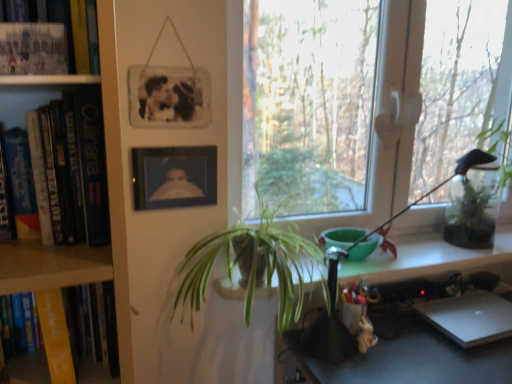
Question: Is transparent glass window at center positioned behind hardcover book at left, which ranks as the third book in top-to-bottom order?

Choices:
 (A) yes
 (B) no

Answer: (A)

Question: Considering the relative positions of transparent glass window at center and hardcover book at left, acting as the second book starting from the bottom, in the image provided, is transparent glass window at center to the left of hardcover book at left, acting as the second book starting from the bottom, from the viewer's perspective?

Choices:
 (A) yes
 (B) no

Answer: (B)

Question: Is transparent glass window at center to the right of hardcover book at left, which ranks as the third book in top-to-bottom order, from the viewer's perspective?

Choices:
 (A) no
 (B) yes

Answer: (B)

Question: Is hardcover book at left, acting as the second book starting from the bottom, at the back of transparent glass window at center?

Choices:
 (A) yes
 (B) no

Answer: (B)

Question: From a real-world perspective, is transparent glass window at center on hardcover book at left, which ranks as the third book in top-to-bottom order?

Choices:
 (A) yes
 (B) no

Answer: (A)

Question: Can you confirm if transparent glass window at center is taller than hardcover book at left, which ranks as the third book in top-to-bottom order?

Choices:
 (A) yes
 (B) no

Answer: (A)

Question: Can you confirm if black matte picture frame at upper center, which is the 1th picture frame in top-to-bottom order, is smaller than green leafy plant at right, which is the 1th houseplant from back to front?

Choices:
 (A) yes
 (B) no

Answer: (A)

Question: From the image's perspective, is black matte picture frame at upper center, marked as the 2th picture frame in a bottom-to-top arrangement, over green leafy plant at right, the second houseplant from the left?

Choices:
 (A) no
 (B) yes

Answer: (B)

Question: Is black matte picture frame at upper center, marked as the 2th picture frame in a bottom-to-top arrangement, turned away from green leafy plant at right, the second houseplant from the front?

Choices:
 (A) yes
 (B) no

Answer: (B)

Question: Does black matte picture frame at upper center, which is the 1th picture frame in top-to-bottom order, contain green leafy plant at right, the second houseplant from the left?

Choices:
 (A) yes
 (B) no

Answer: (B)

Question: Considering the relative positions of black matte picture frame at upper center, marked as the 2th picture frame in a bottom-to-top arrangement, and green leafy plant at right, the second houseplant from the left, in the image provided, is black matte picture frame at upper center, marked as the 2th picture frame in a bottom-to-top arrangement, behind green leafy plant at right, the second houseplant from the left,?

Choices:
 (A) yes
 (B) no

Answer: (B)

Question: Considering the relative sizes of black matte picture frame at upper center, which is the 1th picture frame in top-to-bottom order, and green leafy plant at right, arranged as the 1th houseplant when viewed from the right, in the image provided, is black matte picture frame at upper center, which is the 1th picture frame in top-to-bottom order, thinner than green leafy plant at right, arranged as the 1th houseplant when viewed from the right,?

Choices:
 (A) yes
 (B) no

Answer: (A)

Question: Is matte paper book at upper left, the 4th book from the bottom, next to silver metallic laptop at lower right?

Choices:
 (A) yes
 (B) no

Answer: (B)